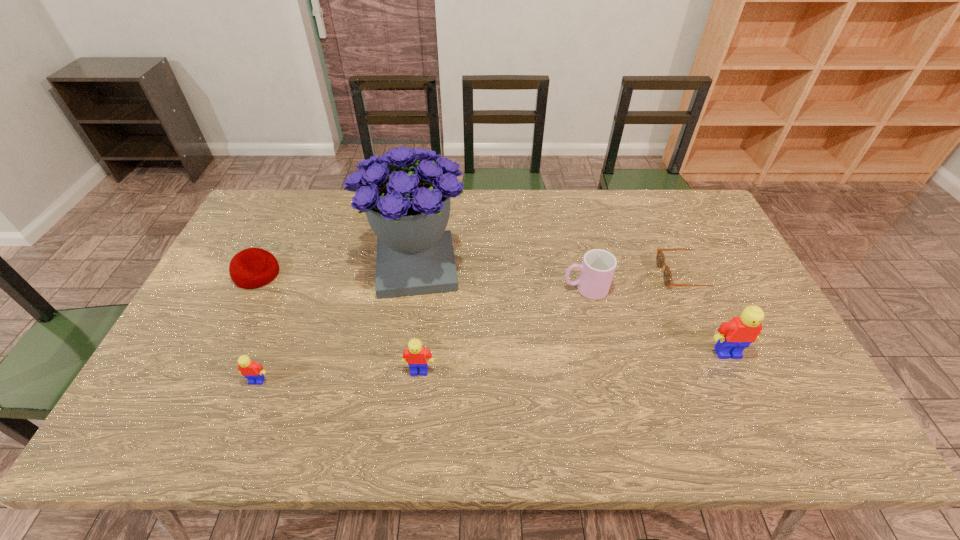
Locate an element on the screen. object at the left edge is located at coordinates (251, 268).

This screenshot has width=960, height=540. What are the coordinates of `Lego that is at the right edge` in the screenshot? It's located at (734, 336).

I want to click on sunglasses positioned at the right edge, so click(660, 258).

Locate an element on the screen. vacant area at the far edge is located at coordinates (365, 230).

Locate an element on the screen. vacant area at the near edge of the desktop is located at coordinates (296, 383).

In the image, there is a desktop. What are the coordinates of `vacant space at the left edge` in the screenshot? It's located at (185, 336).

Where is `vacant area at the far left corner`? vacant area at the far left corner is located at coordinates (273, 215).

In the image, there is a desktop. Find the location of `vacant space at the far right corner`. vacant space at the far right corner is located at coordinates (662, 197).

In the image, there is a desktop. Where is `free region at the near right corner`? The image size is (960, 540). free region at the near right corner is located at coordinates (792, 387).

At what (x,y) coordinates should I click in order to perform the action: click on vacant area that lies between the leftmost Lego and the cup. Please return your answer as a coordinate pair (x, y). The width and height of the screenshot is (960, 540). Looking at the image, I should click on (421, 335).